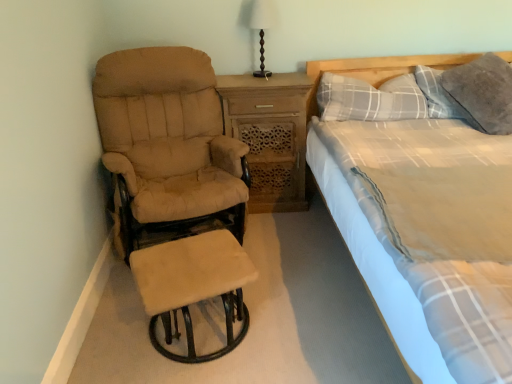
Question: Choose the correct answer: Is beige fabric recliner at left inside matte brown wooden lamp at upper center or outside it?

Choices:
 (A) inside
 (B) outside

Answer: (B)

Question: From the image's perspective, relative to matte brown wooden lamp at upper center, is beige fabric recliner at left above or below?

Choices:
 (A) below
 (B) above

Answer: (A)

Question: Which object is the closest to the light gray plaid fabric bed at right?

Choices:
 (A) matte brown wooden lamp at upper center
 (B) beige fabric recliner at left
 (C) wooden nightstand at center
 (D) beige suede stool at lower left
 (E) gray soft pillow at upper right, marked as the first pillow in a right-to-left arrangement

Answer: (E)

Question: Which object is the farthest from the beige fabric recliner at left?

Choices:
 (A) gray plaid pillow at upper right, marked as the 1th pillow in a left-to-right arrangement
 (B) matte brown wooden lamp at upper center
 (C) wooden nightstand at center
 (D) gray soft pillow at upper right, the 2th pillow viewed from the left
 (E) light gray plaid fabric bed at right

Answer: (D)